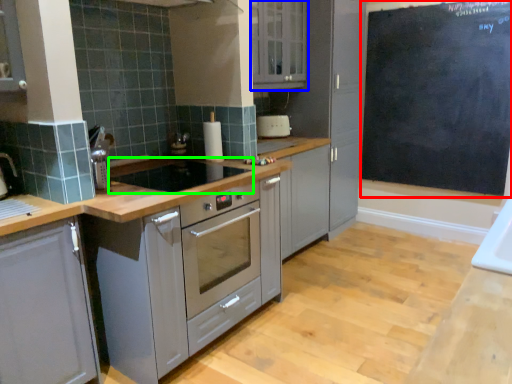
Question: Which object is positioned farthest from bulletin board (highlighted by a red box)? Select from cabinetry (highlighted by a blue box) and gas stove (highlighted by a green box).

Choices:
 (A) cabinetry
 (B) gas stove

Answer: (B)